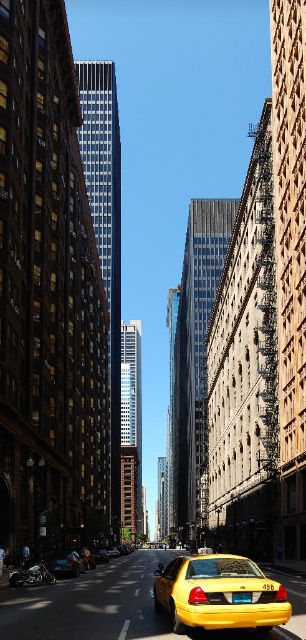
Between yellow metallic taxi at center and yellow matte taxi at center, which one is positioned lower?

yellow matte taxi at center is below.

Does yellow metallic taxi at center have a lesser width compared to yellow matte taxi at center?

No.

Does point (103, 556) lie in front of point (115, 552)?

Yes, point (103, 556) is in front of point (115, 552).

This screenshot has height=640, width=306. Identify the location of yellow metallic taxi at center. (100, 556).

You are a GUI agent. You are given a task and a screenshot of the screen. Output one action in this format:
    pyautogui.click(x=<x>, y=<y>)
    Task: Click on the shiny black car at lower left
    The width and height of the screenshot is (306, 640).
    Given the screenshot: What is the action you would take?
    pyautogui.click(x=66, y=563)

Does point (55, 568) lie behind point (101, 548)?

No.

Identify the location of shiny black car at lower left. The width and height of the screenshot is (306, 640). click(66, 563).

Does yellow matte taxi at lower center have a lesser width compared to shiny black car at lower left?

No, yellow matte taxi at lower center is not thinner than shiny black car at lower left.

Where is `yellow matte taxi at lower center`? yellow matte taxi at lower center is located at coordinates (219, 593).

Where is `yellow matte taxi at lower center`? yellow matte taxi at lower center is located at coordinates (219, 593).